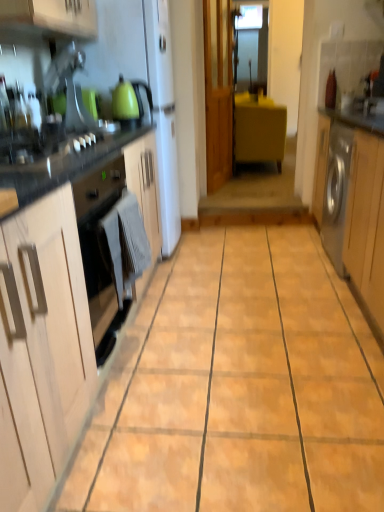
Question: Considering the relative positions of matte green kettle at upper left and gray fabric towel at lower left in the image provided, is matte green kettle at upper left to the right of gray fabric towel at lower left from the viewer's perspective?

Choices:
 (A) no
 (B) yes

Answer: (A)

Question: From a real-world perspective, is matte green kettle at upper left located higher than gray fabric towel at lower left?

Choices:
 (A) no
 (B) yes

Answer: (B)

Question: Does matte green kettle at upper left touch gray fabric towel at lower left?

Choices:
 (A) no
 (B) yes

Answer: (A)

Question: From a real-world perspective, is matte green kettle at upper left located beneath gray fabric towel at lower left?

Choices:
 (A) yes
 (B) no

Answer: (B)

Question: Is matte green kettle at upper left turned away from gray fabric towel at lower left?

Choices:
 (A) no
 (B) yes

Answer: (A)

Question: Is matte green kettle at upper left not close to gray fabric towel at lower left?

Choices:
 (A) no
 (B) yes

Answer: (B)

Question: Is silver metallic washing machine at right, which is counted as the first cabinetry, starting from the right, far from yellow matte cabinet at center, acting as the second cabinetry starting from the right?

Choices:
 (A) no
 (B) yes

Answer: (B)

Question: From the image's perspective, is silver metallic washing machine at right, the 2th cabinetry ordered from the bottom, over yellow matte cabinet at center, the first cabinetry viewed from the back?

Choices:
 (A) no
 (B) yes

Answer: (A)

Question: Could you tell me if silver metallic washing machine at right, the 2th cabinetry when ordered from top to bottom, is turned towards yellow matte cabinet at center, acting as the second cabinetry starting from the right?

Choices:
 (A) yes
 (B) no

Answer: (B)

Question: Considering the relative sizes of silver metallic washing machine at right, which is counted as the first cabinetry, starting from the right, and yellow matte cabinet at center, which is the 1th cabinetry from top to bottom, in the image provided, is silver metallic washing machine at right, which is counted as the first cabinetry, starting from the right, thinner than yellow matte cabinet at center, which is the 1th cabinetry from top to bottom,?

Choices:
 (A) no
 (B) yes

Answer: (B)

Question: Can you confirm if silver metallic washing machine at right, the second cabinetry viewed from the back, is shorter than yellow matte cabinet at center, which is the 1th cabinetry from top to bottom?

Choices:
 (A) no
 (B) yes

Answer: (A)

Question: Is silver metallic washing machine at right, the second cabinetry viewed from the back, to the right of yellow matte cabinet at center, the first cabinetry viewed from the back, from the viewer's perspective?

Choices:
 (A) no
 (B) yes

Answer: (B)

Question: Is gray fabric towel at lower left far away from yellow matte cabinet at center, which ranks as the 3th cabinetry in front-to-back order?

Choices:
 (A) yes
 (B) no

Answer: (A)